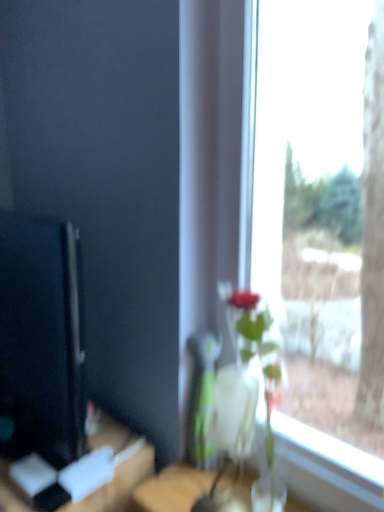
This screenshot has height=512, width=384. What do you see at coordinates (41, 337) in the screenshot?
I see `black glossy computer monitor at left` at bounding box center [41, 337].

Measure the distance between wooden table at lower left and camera.

wooden table at lower left is 1.07 meters away from camera.

The width and height of the screenshot is (384, 512). In order to click on black glossy computer monitor at left in this screenshot , I will do `click(41, 337)`.

How different are the orientations of clear glass vase at center and transparent glass vase at center in degrees?

The facing directions of clear glass vase at center and transparent glass vase at center are 0.925 degrees apart.

From a real-world perspective, is clear glass vase at center physically below transparent glass vase at center?

Correct, in the physical world, clear glass vase at center is lower than transparent glass vase at center.

Does point (232, 387) lie in front of point (255, 490)?

Yes, it is in front of point (255, 490).

Find the location of a particular element. The image size is (384, 512). houseplant located above the clear glass vase at center (from the image's perspective) is located at coordinates (236, 394).

From the image's perspective, is wooden table at lower left above clear glass vase at center?

Actually, wooden table at lower left appears below clear glass vase at center in the image.

Considering the sizes of objects wooden table at lower left and clear glass vase at center in the image provided, who is taller, wooden table at lower left or clear glass vase at center?

wooden table at lower left.

Does wooden table at lower left lie in front of clear glass vase at center?

No, wooden table at lower left is behind clear glass vase at center.

Based on the photo, could clear glass vase at center be considered to be inside wooden table at lower left?

No, clear glass vase at center is not inside wooden table at lower left.

Who is smaller, wooden table at lower left or transparent glass vase at center?

transparent glass vase at center.

Is wooden table at lower left positioned beyond the bounds of transparent glass vase at center?

That's correct, wooden table at lower left is outside of transparent glass vase at center.

Is wooden table at lower left facing towards transparent glass vase at center?

No, wooden table at lower left is not oriented towards transparent glass vase at center.

Which of these two, wooden table at lower left or transparent glass vase at center, is wider?

wooden table at lower left is wider.

From a real-world perspective, does clear glass vase at center stand above wooden table at lower left?

Yes, from a real-world perspective, clear glass vase at center is above wooden table at lower left.

Considering the sizes of objects clear glass vase at center and wooden table at lower left in the image provided, who is shorter, clear glass vase at center or wooden table at lower left?

Standing shorter between the two is clear glass vase at center.

Is clear glass vase at center not inside wooden table at lower left?

clear glass vase at center lies outside wooden table at lower left's area.

Could you tell me if transparent glass vase at center is turned towards clear glass vase at center?

Yes, transparent glass vase at center is facing clear glass vase at center.

From the image's perspective, is transparent glass vase at center above or below clear glass vase at center?

From the image's perspective, transparent glass vase at center appears above clear glass vase at center.

Which of these two, transparent glass vase at center or clear glass vase at center, is smaller?

Smaller between the two is clear glass vase at center.

Considering the sizes of objects transparent glass vase at center and clear glass vase at center in the image provided, who is taller, transparent glass vase at center or clear glass vase at center?

transparent glass vase at center.

Is black glossy computer monitor at left positioned far away from transparent glass vase at center?

No, there isn't a large distance between black glossy computer monitor at left and transparent glass vase at center.

Does black glossy computer monitor at left appear on the right side of transparent glass vase at center?

No.

The height and width of the screenshot is (512, 384). In order to click on houseplant below the black glossy computer monitor at left (from the image's perspective) in this screenshot , I will do `click(236, 394)`.

Is black glossy computer monitor at left thinner than transparent glass vase at center?

Yes.

Is black glossy computer monitor at left in front of or behind wooden table at lower left in the image?

Clearly, black glossy computer monitor at left is in front of wooden table at lower left.

From their relative heights in the image, would you say black glossy computer monitor at left is taller or shorter than wooden table at lower left?

Clearly, black glossy computer monitor at left is shorter compared to wooden table at lower left.

Looking at this image, how different are the orientations of black glossy computer monitor at left and wooden table at lower left in degrees?

They differ by 0.23 degrees in their facing directions.

Find the location of a particular element. This screenshot has height=512, width=384. houseplant on the right side of clear glass vase at center is located at coordinates (236, 394).

I want to click on table behind the clear glass vase at center, so click(117, 469).

Looking at the image, which one is located closer to wooden table at lower left, transparent glass vase at center or black glossy computer monitor at left?

black glossy computer monitor at left is closer to wooden table at lower left.

Based on their spatial positions, is wooden table at lower left or transparent glass vase at center closer to black glossy computer monitor at left?

wooden table at lower left is positioned closer to the anchor black glossy computer monitor at left.

Looking at the image, which one is located further to transparent glass vase at center, black glossy computer monitor at left or clear glass vase at center?

Based on the image, black glossy computer monitor at left appears to be further to transparent glass vase at center.

Considering their positions, is black glossy computer monitor at left positioned further to wooden table at lower left than clear glass vase at center?

clear glass vase at center.

From the image, which object appears to be farther from clear glass vase at center, wooden table at lower left or transparent glass vase at center?

wooden table at lower left.

From the image, which object appears to be nearer to black glossy computer monitor at left, transparent glass vase at center or clear glass vase at center?

The object closer to black glossy computer monitor at left is transparent glass vase at center.

Looking at the image, which one is located further to black glossy computer monitor at left, clear glass vase at center or transparent glass vase at center?

clear glass vase at center.

When comparing their distances from clear glass vase at center, does black glossy computer monitor at left or transparent glass vase at center seem further?

black glossy computer monitor at left lies further to clear glass vase at center than the other object.

Find the location of a particular element. vase between wooden table at lower left and transparent glass vase at center is located at coordinates (234, 411).

Image resolution: width=384 pixels, height=512 pixels. What are the coordinates of `vase between black glossy computer monitor at left and wooden table at lower left from top to bottom` in the screenshot? It's located at (234, 411).

Find the location of a particular element. computer monitor situated between wooden table at lower left and transparent glass vase at center from left to right is located at coordinates (41, 337).

You are a GUI agent. You are given a task and a screenshot of the screen. Output one action in this format:
    pyautogui.click(x=<x>, y=<y>)
    Task: Click on the vase between black glossy computer monitor at left and transparent glass vase at center
    
    Given the screenshot: What is the action you would take?
    pyautogui.click(x=234, y=411)